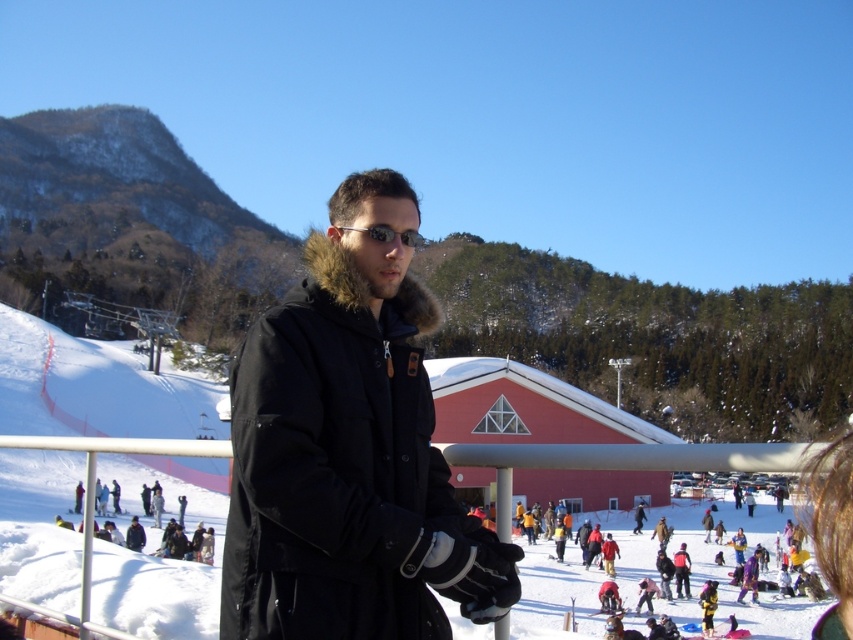
Does black fur-lined coat at center have a greater height compared to white fluffy snow at center?

No.

Consider the image. Which of these two, black fur-lined coat at center or white fluffy snow at center, stands taller?

white fluffy snow at center is taller.

What do you see at coordinates (349, 451) in the screenshot?
I see `black fur-lined coat at center` at bounding box center [349, 451].

What are the coordinates of `black fur-lined coat at center` in the screenshot? It's located at pos(349,451).